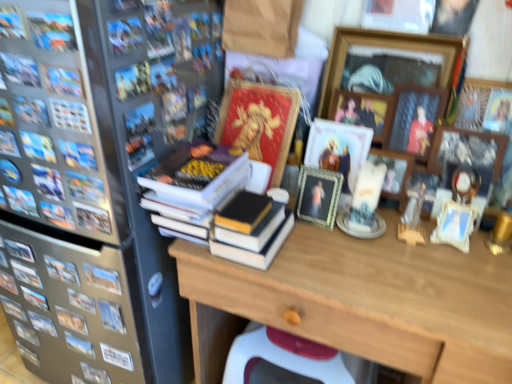
The image size is (512, 384). What are the coordinates of `empty space that is ontop of wooden desk at center` in the screenshot? It's located at (399, 259).